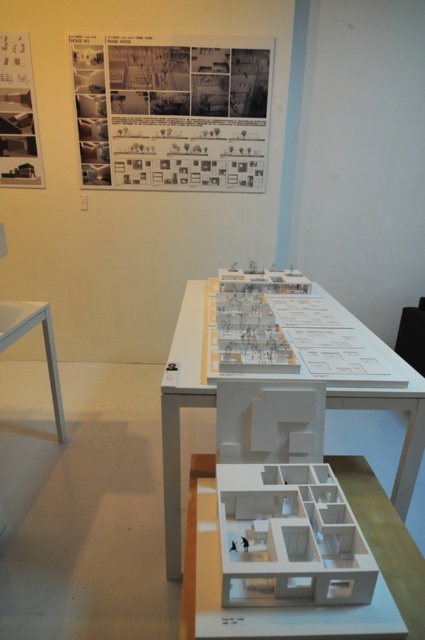
Based on the photo, you are an architect reviewing the display. You notice the black paper at upper center and the white matte model at center. Which object is positioned higher up in the scene?

The black paper at upper center is positioned higher up than the white matte model at center.

You are an architect reviewing the display. You notice the white matte model house at center and the white paper poster at upper left. Which object is closer to you from your current viewpoint?

The white matte model house at center is closer to you because it is in front of the white paper poster at upper left.